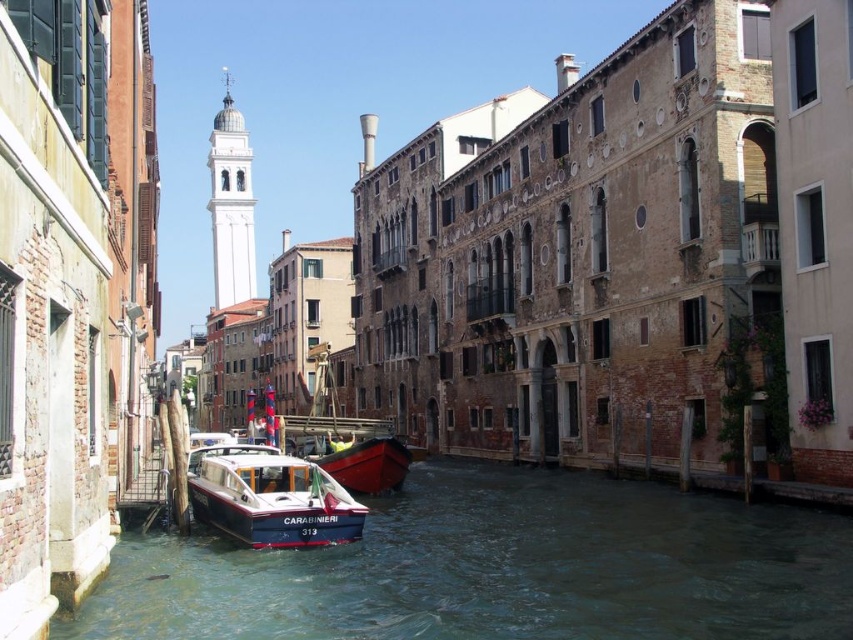
Between clear water at lower left and red polished wood boat at center, which one is positioned lower?

clear water at lower left is lower down.

Can you confirm if clear water at lower left is positioned below red polished wood boat at center?

Correct, clear water at lower left is located below red polished wood boat at center.

Between point (473, 557) and point (370, 460), which one is positioned in front?

Point (473, 557)

Identify the location of clear water at lower left. (x=498, y=570).

Is clear water at lower left wider than blue polished wood boat at center?

Correct, the width of clear water at lower left exceeds that of blue polished wood boat at center.

Does clear water at lower left appear under blue polished wood boat at center?

Yes.

Does point (770, 628) lie in front of point (312, 529)?

Yes.

Where is `clear water at lower left`? Image resolution: width=853 pixels, height=640 pixels. clear water at lower left is located at coordinates (498, 570).

Consider the image. Does blue polished wood boat at center appear over red polished wood boat at center?

Correct, blue polished wood boat at center is located above red polished wood boat at center.

Is point (315, 467) positioned before point (383, 436)?

That is True.

Find the location of a particular element. blue polished wood boat at center is located at coordinates (270, 497).